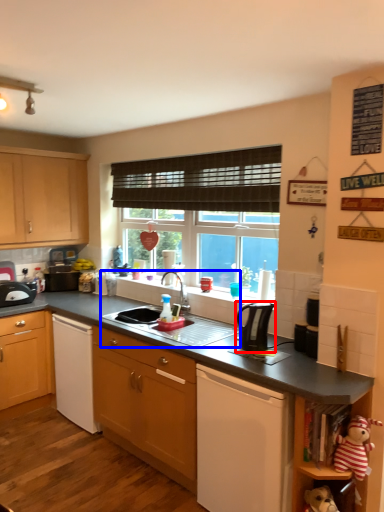
Question: Among these objects, which one is nearest to the camera, kitchen appliance (highlighted by a red box) or sink (highlighted by a blue box)?

Choices:
 (A) kitchen appliance
 (B) sink

Answer: (A)